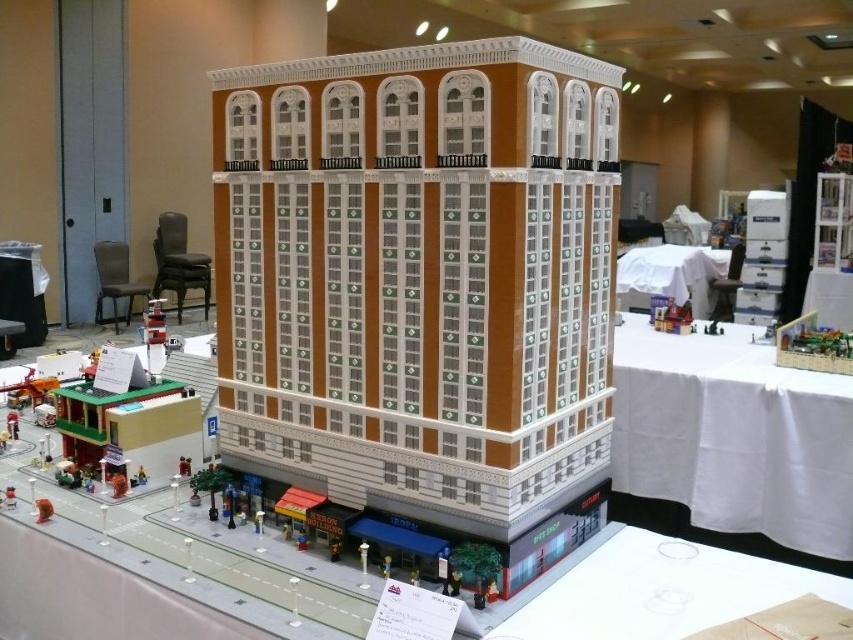
Question: Can you confirm if brown lego building at center is thinner than white glossy table at lower right?

Choices:
 (A) no
 (B) yes

Answer: (A)

Question: Does white glossy table at lower right appear over white fabric table at center?

Choices:
 (A) yes
 (B) no

Answer: (B)

Question: Can you confirm if brown lego building at center is positioned above white fabric table at center?

Choices:
 (A) no
 (B) yes

Answer: (A)

Question: Which of the following is the closest to the observer?

Choices:
 (A) white fabric table at center
 (B) brown lego building at center

Answer: (B)

Question: Which of these objects is positioned closest to the white cloth at upper right?

Choices:
 (A) white glossy table at lower right
 (B) white fabric table at center

Answer: (A)

Question: Estimate the real-world distances between objects in this image. Which object is closer to the white fabric table at center?

Choices:
 (A) brown lego building at center
 (B) white glossy table at lower right
 (C) white cloth at upper right

Answer: (C)